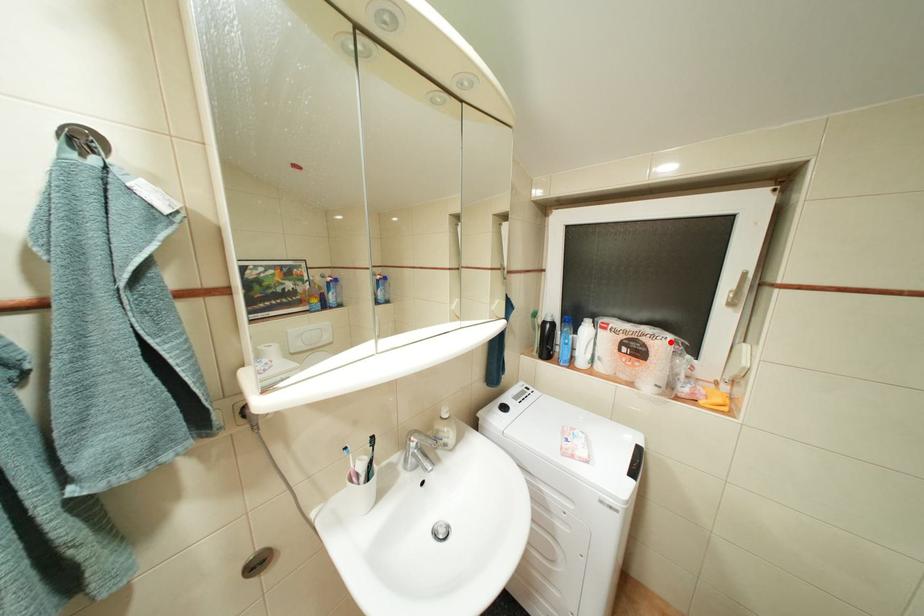
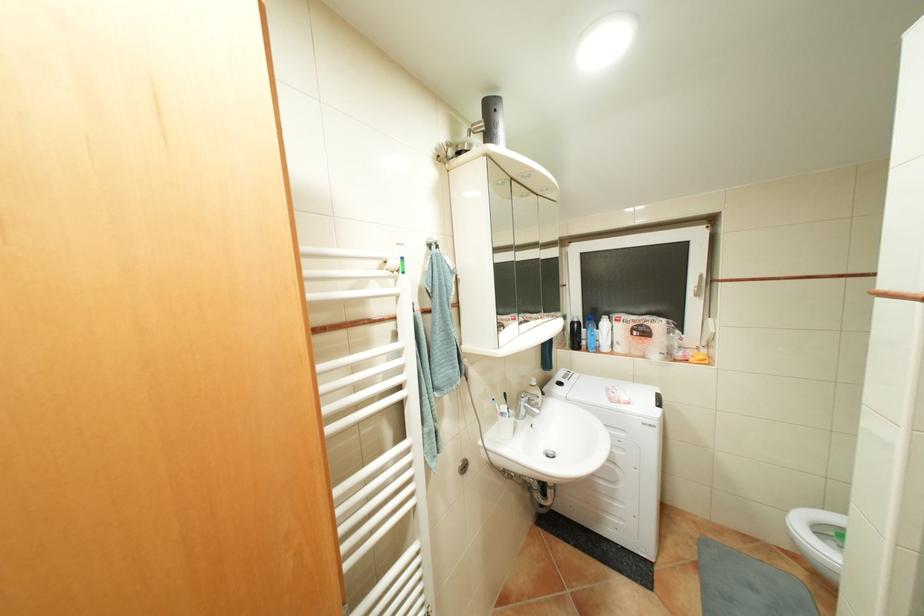
The point at the highlighted location is marked in the first image. Where is the corresponding point in the second image?

(667, 323)